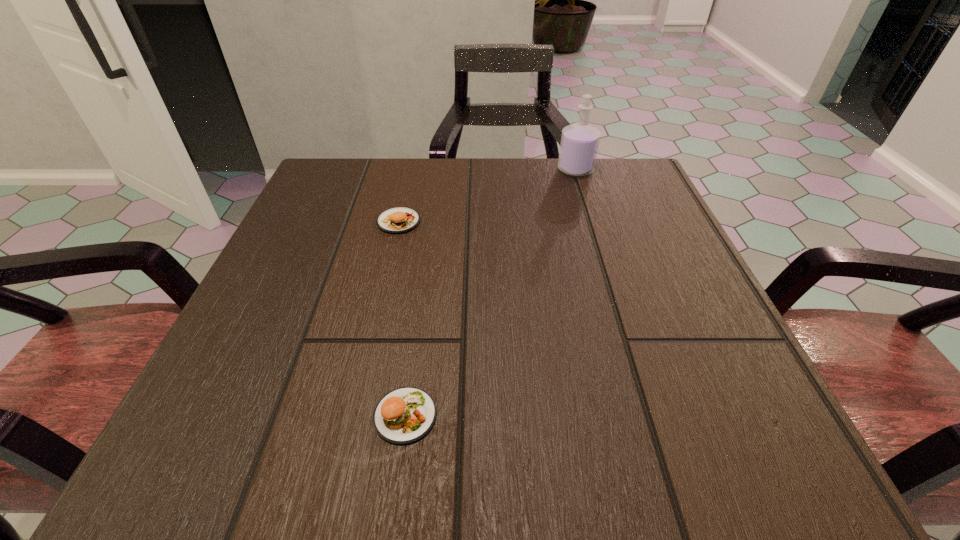
I want to click on free spot between the nearest object and the tallest object, so click(491, 293).

Point out which object is positioned as the second nearest to the taller patty. Please provide its 2D coordinates. Your answer should be formatted as a tuple, i.e. [(x, y)], where the tuple contains the x and y coordinates of a point satisfying the conditions above.

[(404, 415)]

The image size is (960, 540). What are the coordinates of `object identified as the closest to the nearest object` in the screenshot? It's located at (397, 220).

The image size is (960, 540). I want to click on free space that satisfies the following two spatial constraints: 1. on the back side of the shortest object; 2. on the right side of the perfume, so click(439, 170).

Where is `free spot that satisfies the following two spatial constraints: 1. on the back side of the nearest object; 2. on the right side of the rightmost object`? free spot that satisfies the following two spatial constraints: 1. on the back side of the nearest object; 2. on the right side of the rightmost object is located at coordinates (439, 170).

In order to click on vacant space that satisfies the following two spatial constraints: 1. on the back side of the shorter patty; 2. on the left side of the perfume in this screenshot , I will do `click(439, 170)`.